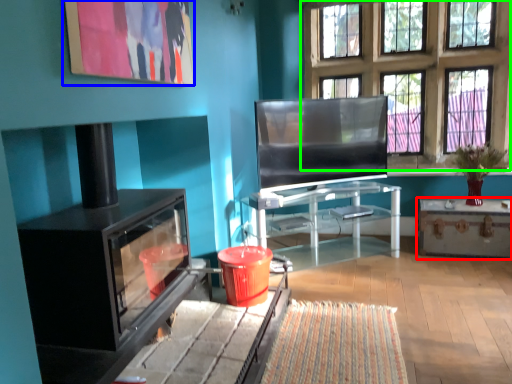
Question: Which object is positioned farthest from table (highlighted by a red box)? Select from picture frame (highlighted by a blue box) and window (highlighted by a green box).

Choices:
 (A) picture frame
 (B) window

Answer: (A)